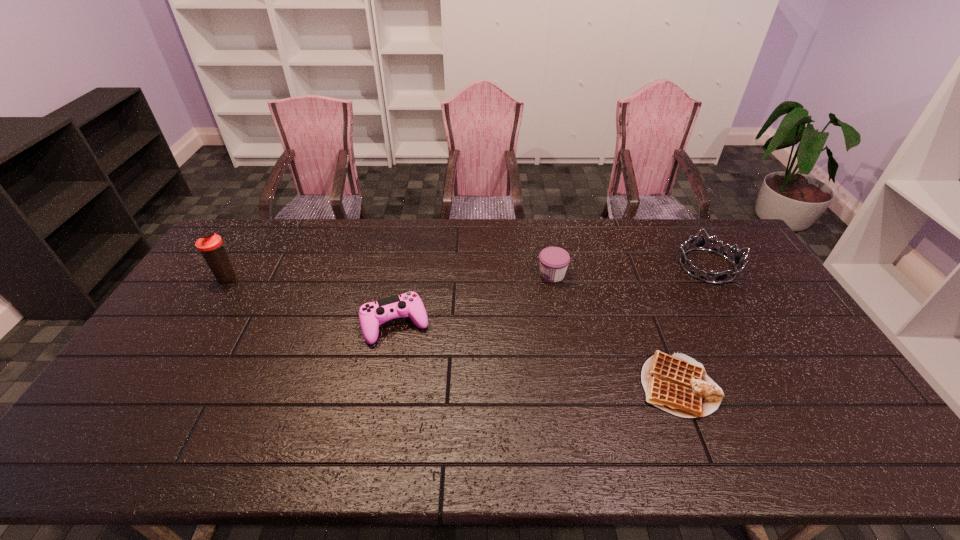
The height and width of the screenshot is (540, 960). In order to click on vacant region that satisfies the following two spatial constraints: 1. on the front-facing side of the tiara; 2. on the front side of the fourth farthest object in this screenshot , I will do `click(742, 325)`.

Where is `vacant region that satisfies the following two spatial constraints: 1. on the front-facing side of the tiara; 2. on the front side of the thermos bottle`? The height and width of the screenshot is (540, 960). vacant region that satisfies the following two spatial constraints: 1. on the front-facing side of the tiara; 2. on the front side of the thermos bottle is located at coordinates (714, 277).

Where is `vacant region that satisfies the following two spatial constraints: 1. on the front side of the tallest object; 2. on the left side of the second object from left to right`? vacant region that satisfies the following two spatial constraints: 1. on the front side of the tallest object; 2. on the left side of the second object from left to right is located at coordinates (x=198, y=325).